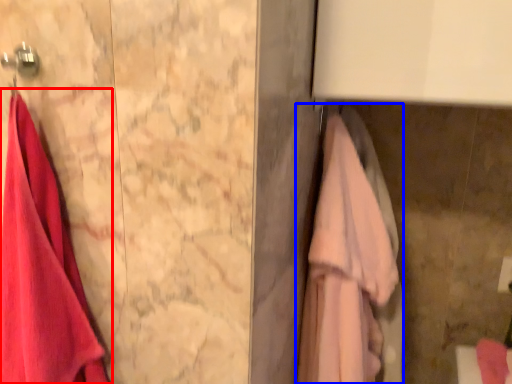
Question: Among these objects, which one is nearest to the camera, towel (highlighted by a red box) or towel (highlighted by a blue box)?

Choices:
 (A) towel
 (B) towel

Answer: (A)